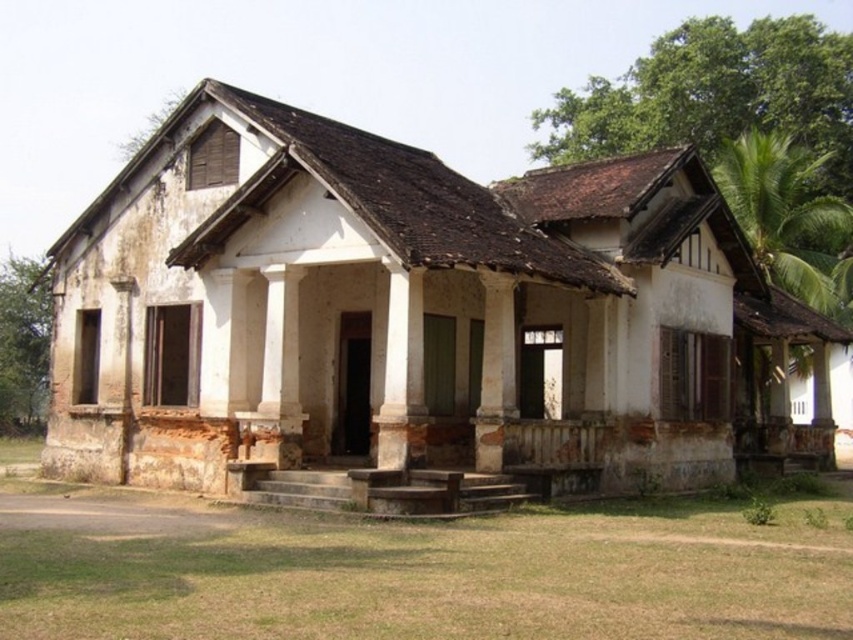
You are an architect assessing the structural integrity of the building. You notice the white smooth pillar at center and the brown weathered wood column at center. Which one has a greater width?

The white smooth pillar at center has a greater width than the brown weathered wood column at center.

You are an architect inspecting the old building. You notice the white smooth pillar at center and the brown weathered wood column at center. Which one is taller?

The white smooth pillar at center is much taller than the brown weathered wood column at center.

From the picture: You are standing at the base of the building and want to touch both the white smooth pillar at center and the brown weathered wood column at center. Which one do you need to walk towards first?

The white smooth pillar at center is closer to the viewer than the brown weathered wood column at center, so you should touch the white smooth pillar at center first before moving further to reach the brown weathered wood column at center.